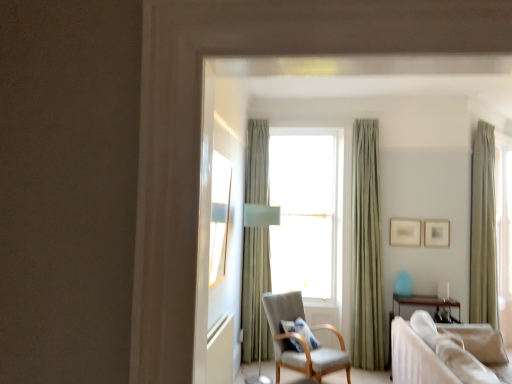
Question: Considering the positions of teal glass vase at center-right and beige fabric couch at lower right in the image, is teal glass vase at center-right wider or thinner than beige fabric couch at lower right?

Choices:
 (A) wide
 (B) thin

Answer: (B)

Question: Choose the correct answer: Is teal glass vase at center-right inside beige fabric couch at lower right or outside it?

Choices:
 (A) inside
 (B) outside

Answer: (B)

Question: Estimate the real-world distances between objects in this image. Which object is closer to the light gray fabric chair at center?

Choices:
 (A) blue cotton pillow at center
 (B) sage green fabric curtain at center, the second curtain from the right
 (C) beige fabric couch at lower right
 (D) green velvet curtain at right, which is the 1th curtain in right-to-left order
 (E) green fabric curtain at center, which ranks as the 3th curtain in right-to-left order

Answer: (A)

Question: Which object is the closest to the white fabric window at center?

Choices:
 (A) light gray fabric chair at center
 (B) green fabric curtain at center, the first curtain positioned from the left
 (C) matte gold picture frame at center right, which is the first picture frame from left to right
 (D) green velvet curtain at right, which is counted as the 3th curtain, starting from the left
 (E) sage green fabric curtain at center, acting as the 2th curtain starting from the left

Answer: (E)